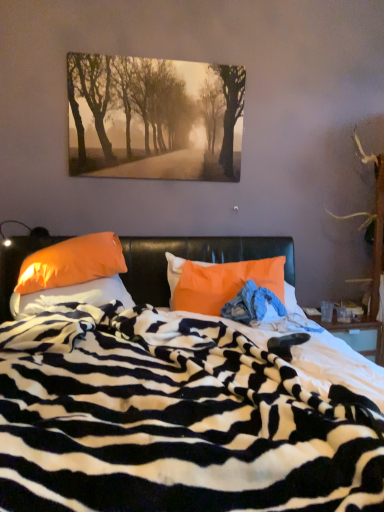
Question: Is orange fabric pillow at left, arranged as the 3th pillow when viewed from the right, facing away from blue denim jeans at center?

Choices:
 (A) yes
 (B) no

Answer: (B)

Question: Is the position of orange fabric pillow at left, placed as the 1th pillow when sorted from left to right, less distant than that of blue denim jeans at center?

Choices:
 (A) yes
 (B) no

Answer: (A)

Question: From a real-world perspective, is orange fabric pillow at left, placed as the 1th pillow when sorted from left to right, physically below blue denim jeans at center?

Choices:
 (A) no
 (B) yes

Answer: (B)

Question: Can you confirm if orange fabric pillow at left, arranged as the 3th pillow when viewed from the right, is positioned to the right of blue denim jeans at center?

Choices:
 (A) no
 (B) yes

Answer: (A)

Question: Is orange fabric pillow at left, arranged as the 3th pillow when viewed from the right, shorter than blue denim jeans at center?

Choices:
 (A) yes
 (B) no

Answer: (B)

Question: Choose the correct answer: Is zebra-patterned fabric at center inside orange fabric pillow at left, placed as the 1th pillow when sorted from left to right, or outside it?

Choices:
 (A) inside
 (B) outside

Answer: (B)

Question: Considering the relative positions of zebra-patterned fabric at center and orange fabric pillow at left, placed as the 1th pillow when sorted from left to right, in the image provided, is zebra-patterned fabric at center to the left or to the right of orange fabric pillow at left, placed as the 1th pillow when sorted from left to right,?

Choices:
 (A) right
 (B) left

Answer: (A)

Question: From a real-world perspective, is zebra-patterned fabric at center physically located above or below orange fabric pillow at left, placed as the 1th pillow when sorted from left to right?

Choices:
 (A) below
 (B) above

Answer: (A)

Question: Is point (160, 459) closer or farther from the camera than point (72, 287)?

Choices:
 (A) closer
 (B) farther

Answer: (A)

Question: Considering the relative positions of zebra-patterned fabric at center and orange fabric pillow at center, arranged as the first pillow when viewed from the right, in the image provided, is zebra-patterned fabric at center to the left or to the right of orange fabric pillow at center, arranged as the first pillow when viewed from the right,?

Choices:
 (A) left
 (B) right

Answer: (A)

Question: From a real-world perspective, relative to orange fabric pillow at center, arranged as the first pillow when viewed from the right, is zebra-patterned fabric at center vertically above or below?

Choices:
 (A) above
 (B) below

Answer: (B)

Question: Considering their positions, is zebra-patterned fabric at center located in front of or behind orange fabric pillow at center, arranged as the third pillow when viewed from the left?

Choices:
 (A) front
 (B) behind

Answer: (A)

Question: In terms of height, does zebra-patterned fabric at center look taller or shorter compared to orange fabric pillow at center, arranged as the first pillow when viewed from the right?

Choices:
 (A) short
 (B) tall

Answer: (B)

Question: Visually, is zebra-patterned fabric at center positioned to the left or to the right of matte paper print at upper center?

Choices:
 (A) left
 (B) right

Answer: (B)

Question: From a real-world perspective, is zebra-patterned fabric at center positioned above or below matte paper print at upper center?

Choices:
 (A) above
 (B) below

Answer: (B)